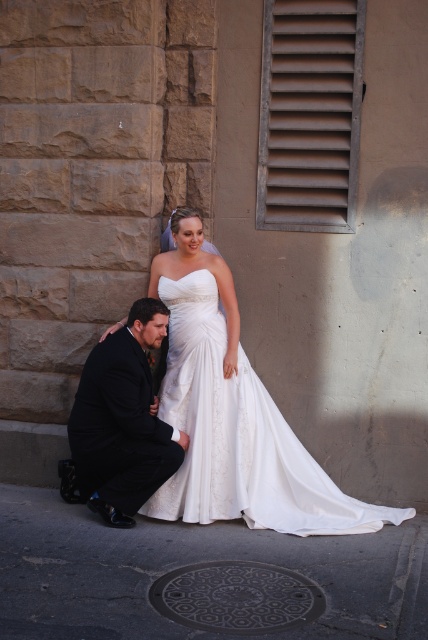
Question: Among these points, which one is farthest from the camera?

Choices:
 (A) (104, 461)
 (B) (252, 412)

Answer: (B)

Question: Is white satin dress at center above dark suit at lower left?

Choices:
 (A) no
 (B) yes

Answer: (A)

Question: Observing the image, what is the correct spatial positioning of white satin dress at center in reference to dark suit at lower left?

Choices:
 (A) right
 (B) left

Answer: (A)

Question: Is white satin dress at center further to camera compared to dark suit at lower left?

Choices:
 (A) yes
 (B) no

Answer: (B)